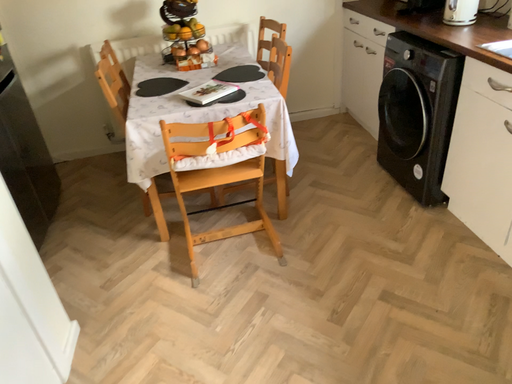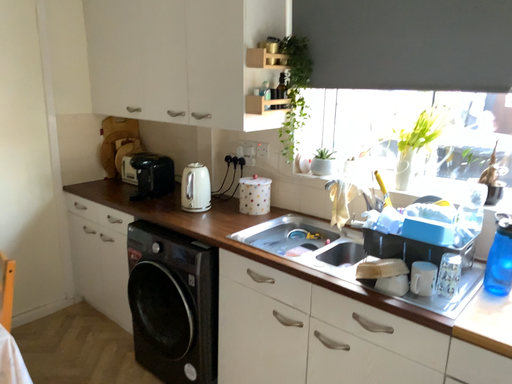
Question: How did the camera likely rotate when shooting the video?

Choices:
 (A) rotated downward
 (B) rotated upward

Answer: (B)